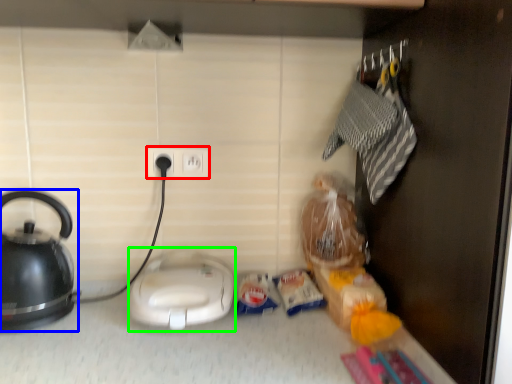
Question: Which object is positioned closest to power plugs and sockets (highlighted by a red box)? Select from kettle (highlighted by a blue box) and appliance (highlighted by a green box).

Choices:
 (A) kettle
 (B) appliance

Answer: (B)